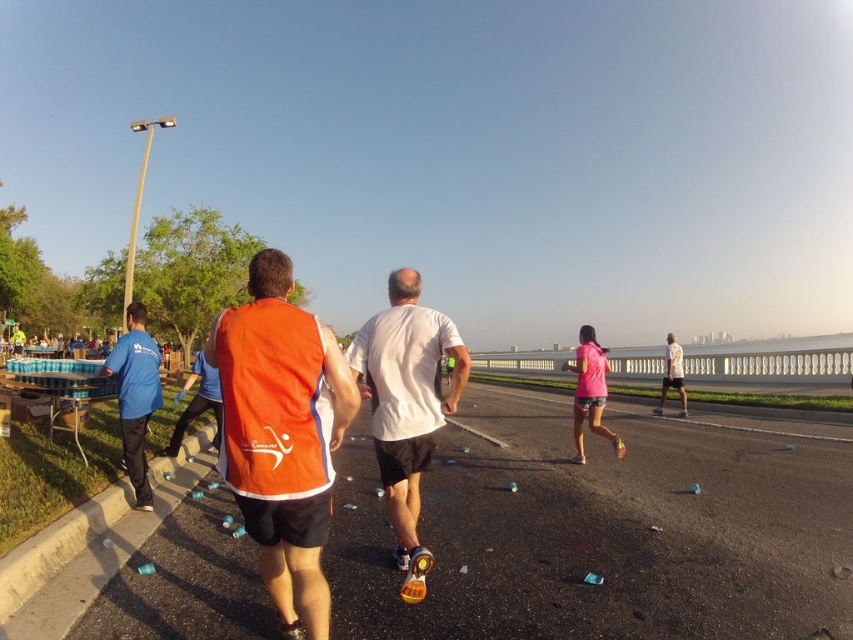
You are a race organizer planning to set up a water station between the white matte shirt at center and the blue fabric shirt at left. Given that the minimum required distance between runners at this point is 3 meters, is the current spacing sufficient for the water station setup?

The white matte shirt at center and blue fabric shirt at left are 3.45 meters apart from each other, which exceeds the minimum required distance of 3 meters. Therefore, the current spacing is sufficient for the water station setup.

You are a photographer at the running event. You want to capture a photo that includes both the blue fabric shirt at left and the pink matte shorts at center. Based on their positions, which object should you focus on first to ensure both are in the frame?

The blue fabric shirt at left is above the pink matte shorts at center, so you should focus on the blue fabric shirt at left first to ensure both are in the frame.

You are a runner in the race and you want to catch up to the person ahead of you. You see two points on the track marked as point (317, 564) and point (144, 426). Which point should you aim to reach first to get closer to the runner in front?

Point (317, 564) is in front of point (144, 426), so you should aim to reach point (317, 564) first to get closer to the runner in front.